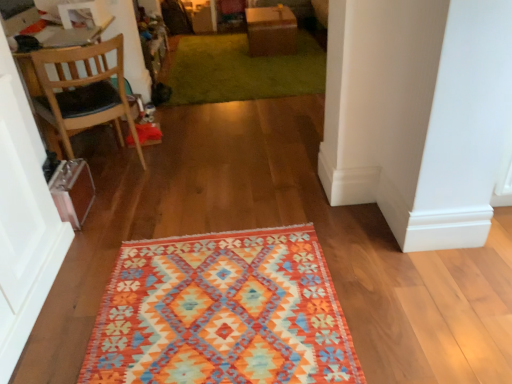
Identify the location of unoccupied region to the right of wooden chair at left. (172, 166).